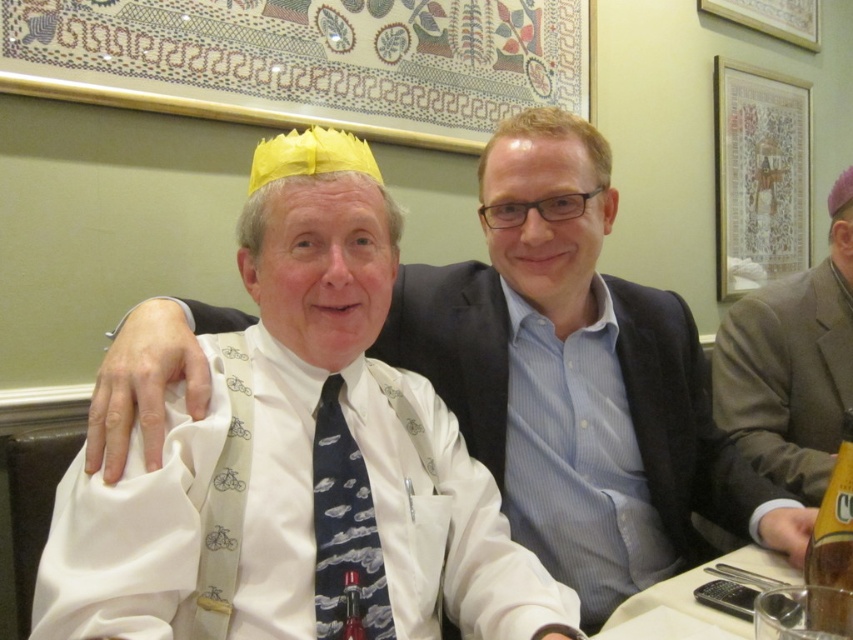
Is matte yellow paper crown at upper left thinner than cloud-patterned silk tie at center?

No.

Describe the element at coordinates (578, 378) in the screenshot. The width and height of the screenshot is (853, 640). I see `matte yellow paper crown at upper left` at that location.

Identify the location of matte yellow paper crown at upper left. (578, 378).

The image size is (853, 640). Identify the location of bicycle-patterned silk tie at left. (224, 500).

Does point (239, 381) lie in front of point (834, 540)?

No, it is not.

Which is behind, point (433, 483) or point (824, 515)?

Positioned behind is point (433, 483).

The height and width of the screenshot is (640, 853). What are the coordinates of `bicycle-patterned silk tie at left` in the screenshot? It's located at (224, 500).

Is point (383, 573) positioned behind point (234, 556)?

Yes.

From the picture: Between cloud-patterned silk tie at center and bicycle-patterned silk tie at left, which one has less height?

cloud-patterned silk tie at center

The height and width of the screenshot is (640, 853). Find the location of `cloud-patterned silk tie at center`. cloud-patterned silk tie at center is located at coordinates (344, 528).

Find the location of a particular element. cloud-patterned silk tie at center is located at coordinates (344, 528).